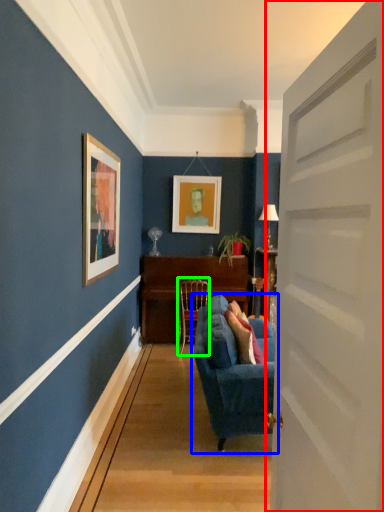
Question: Which is nearer to the door (highlighted by a red box)? studio couch (highlighted by a blue box) or chair (highlighted by a green box).

Choices:
 (A) studio couch
 (B) chair

Answer: (A)